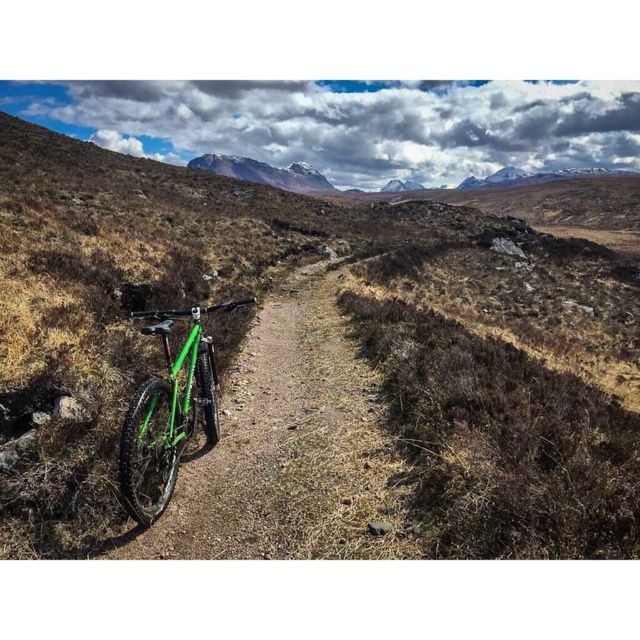
Does green matte bicycle at left come in front of snowy granite mountain at upper center?

Yes, it is in front of snowy granite mountain at upper center.

Is point (426, 477) positioned behind point (221, 156)?

No.

The image size is (640, 640). What do you see at coordinates (324, 362) in the screenshot?
I see `green matte bicycle at left` at bounding box center [324, 362].

The height and width of the screenshot is (640, 640). Identify the location of green matte bicycle at left. (324, 362).

Can you confirm if green matte mountain bike at center is positioned below snowy granite mountain at upper center?

Yes, green matte mountain bike at center is below snowy granite mountain at upper center.

Is point (154, 390) closer to camera compared to point (227, 166)?

That is True.

The image size is (640, 640). I want to click on green matte mountain bike at center, so click(x=168, y=413).

Which of these two, green matte bicycle at left or green matte mountain bike at center, stands shorter?

With less height is green matte mountain bike at center.

Between point (600, 292) and point (188, 371), which one is positioned behind?

The point (600, 292) is behind.

Find the location of a particular element. green matte bicycle at left is located at coordinates (324, 362).